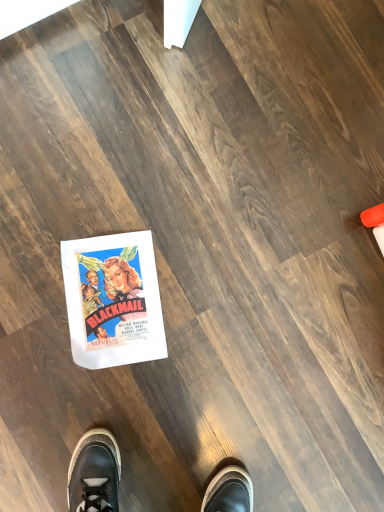
Where is `vacant location below white paper at center (from a real-world perspective)`? vacant location below white paper at center (from a real-world perspective) is located at coordinates (115, 298).